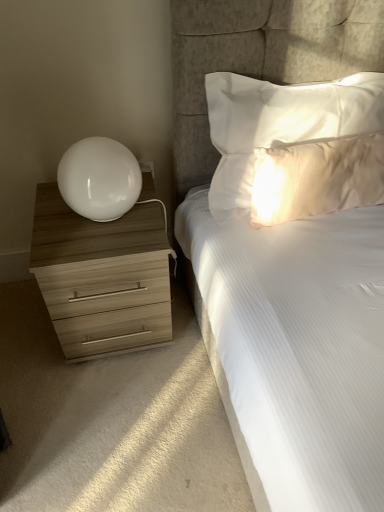
You are a GUI agent. You are given a task and a screenshot of the screen. Output one action in this format:
    pyautogui.click(x=<x>, y=<y>)
    Task: Click on the free space in front of white glossy table lamp at left
    The height and width of the screenshot is (512, 384).
    Given the screenshot: What is the action you would take?
    pyautogui.click(x=91, y=247)